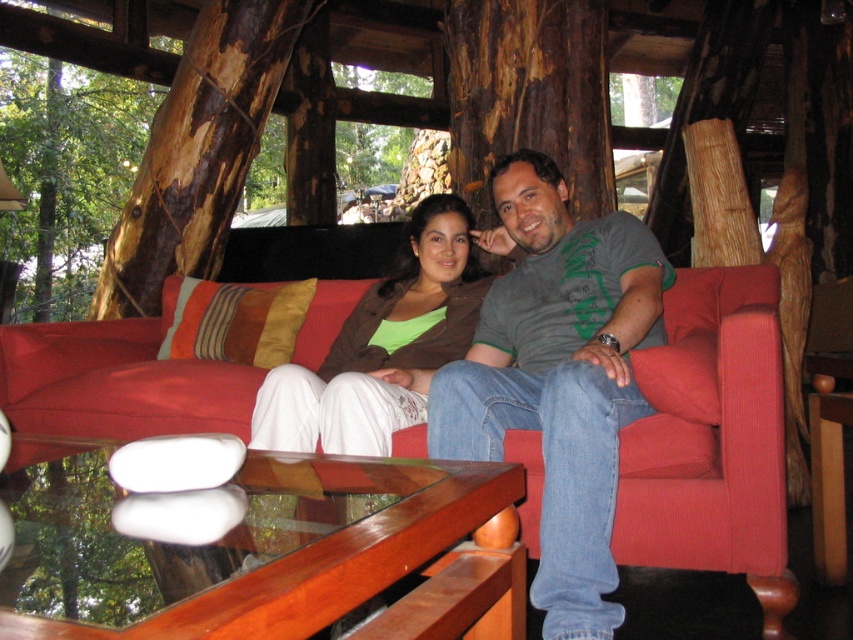
You are planning to place a rectangular cushion that is 1.2 meters wide on the corduroy red couch at center. The matte brown jacket at center is currently placed on the couch. Can the cushion fit on the couch without overlapping the jacket?

The corduroy red couch at center is wider than the matte brown jacket at center. However, the exact dimensions of the couch and the jacket are not provided, so it is uncertain whether the cushion will fit without overlapping the jacket.

You are standing in a rustic wooden cabin and see a vibrant red sofa with colorful throw pillows. There is a point marked at coordinates (x=198, y=150). What is located at this point?

The point at coordinates (x=198, y=150) marks brown rough wood at left.